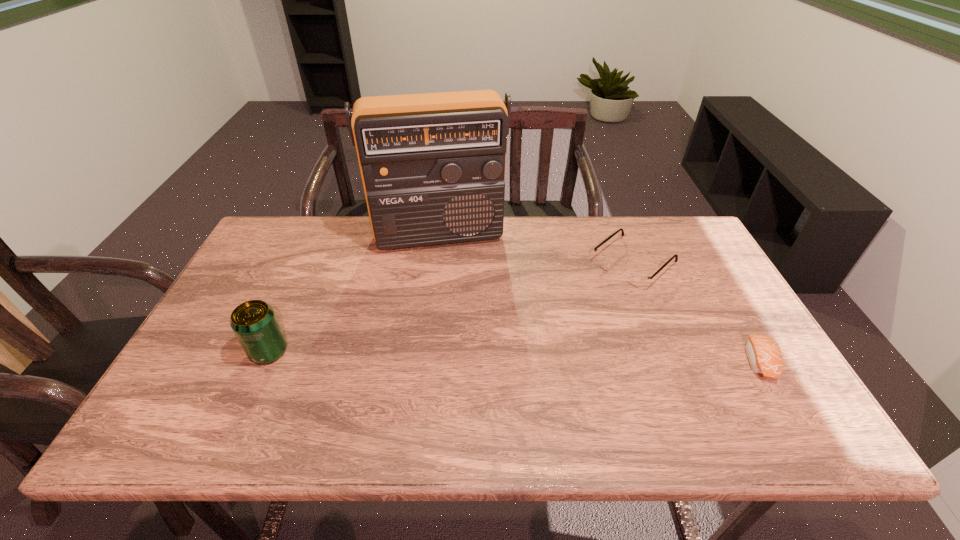
Locate which object is the second closest to the spectacles. Please provide its 2D coordinates. Your answer should be formatted as a tuple, i.e. [(x, y)], where the tuple contains the x and y coordinates of a point satisfying the conditions above.

[(432, 165)]

Where is `vacant space that satisfies the following two spatial constraints: 1. on the front side of the sushi; 2. on the left side of the beer can`? Image resolution: width=960 pixels, height=540 pixels. vacant space that satisfies the following two spatial constraints: 1. on the front side of the sushi; 2. on the left side of the beer can is located at coordinates (265, 361).

At what (x,y) coordinates should I click in order to perform the action: click on free location that satisfies the following two spatial constraints: 1. on the front side of the spectacles; 2. on the left side of the rightmost object. Please return your answer as a coordinate pair (x, y). The height and width of the screenshot is (540, 960). Looking at the image, I should click on click(671, 361).

At what (x,y) coordinates should I click in order to perform the action: click on vacant point that satisfies the following two spatial constraints: 1. on the front side of the sushi; 2. on the left side of the second object from right to left. Please return your answer as a coordinate pair (x, y). The width and height of the screenshot is (960, 540). Looking at the image, I should click on (671, 361).

Where is `free space in the image that satisfies the following two spatial constraints: 1. on the back side of the leftmost object; 2. on the left side of the third object from left to right`? The height and width of the screenshot is (540, 960). free space in the image that satisfies the following two spatial constraints: 1. on the back side of the leftmost object; 2. on the left side of the third object from left to right is located at coordinates (308, 264).